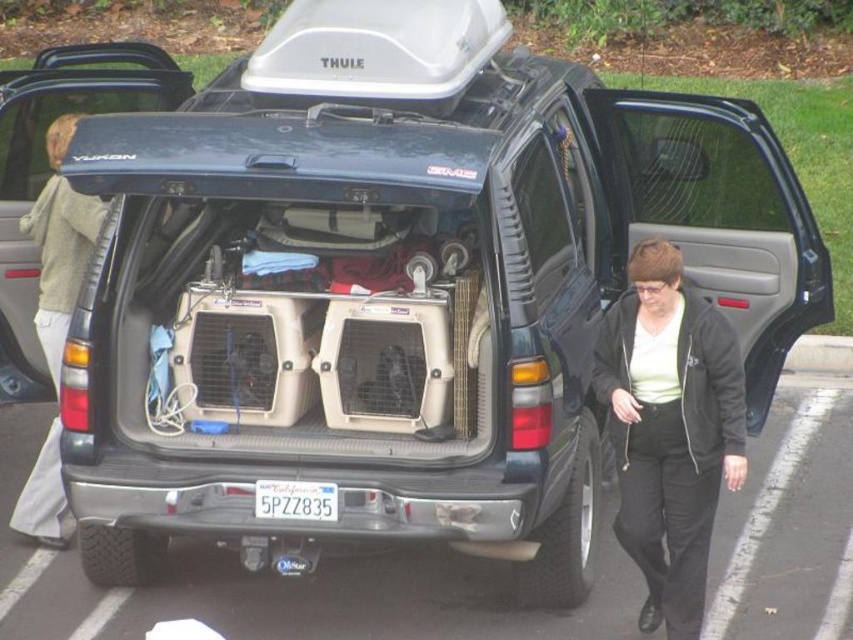
Question: Is light brown cotton pants at left to the left of white plastic license plate at center from the viewer's perspective?

Choices:
 (A) no
 (B) yes

Answer: (B)

Question: Which point is closer to the camera?

Choices:
 (A) white plastic license plate at center
 (B) black rubber parking lot at lower center
 (C) light brown cotton pants at left
 (D) black matte jacket at lower right

Answer: (D)

Question: Estimate the real-world distances between objects in this image. Which object is closer to the white plastic license plate at center?

Choices:
 (A) light brown cotton pants at left
 (B) black matte jacket at lower right
 (C) black rubber parking lot at lower center

Answer: (C)

Question: Which object is the farthest from the white plastic license plate at center?

Choices:
 (A) black matte jacket at lower right
 (B) black rubber parking lot at lower center
 (C) light brown cotton pants at left

Answer: (C)

Question: Is black rubber parking lot at lower center positioned before white plastic license plate at center?

Choices:
 (A) no
 (B) yes

Answer: (A)

Question: Can you confirm if light brown cotton pants at left is positioned to the right of white plastic license plate at center?

Choices:
 (A) no
 (B) yes

Answer: (A)